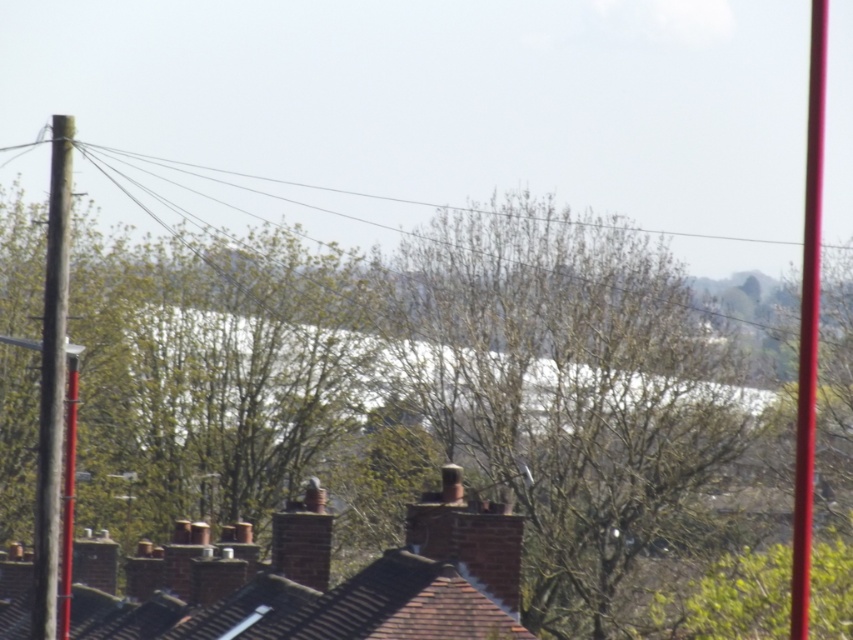
Is green leafy tree at center bigger than smooth wooden pole at left?

Correct, green leafy tree at center is larger in size than smooth wooden pole at left.

Does green leafy tree at center have a greater width compared to smooth wooden pole at left?

Yes, green leafy tree at center is wider than smooth wooden pole at left.

The image size is (853, 640). I want to click on green leafy tree at center, so click(x=408, y=435).

Image resolution: width=853 pixels, height=640 pixels. Describe the element at coordinates (51, 384) in the screenshot. I see `smooth wooden pole at left` at that location.

Can you confirm if smooth wooden pole at left is thinner than smooth glossy pole at right?

Yes.

At what (x,y) coordinates should I click in order to perform the action: click on smooth wooden pole at left. Please return your answer as a coordinate pair (x, y). Looking at the image, I should click on (51, 384).

Who is more forward, (703, 492) or (808, 305)?

Point (703, 492)

Does point (106, 492) come behind point (815, 236)?

No, (106, 492) is closer to viewer.

The image size is (853, 640). In order to click on green leafy tree at center in this screenshot , I will do `click(408, 435)`.